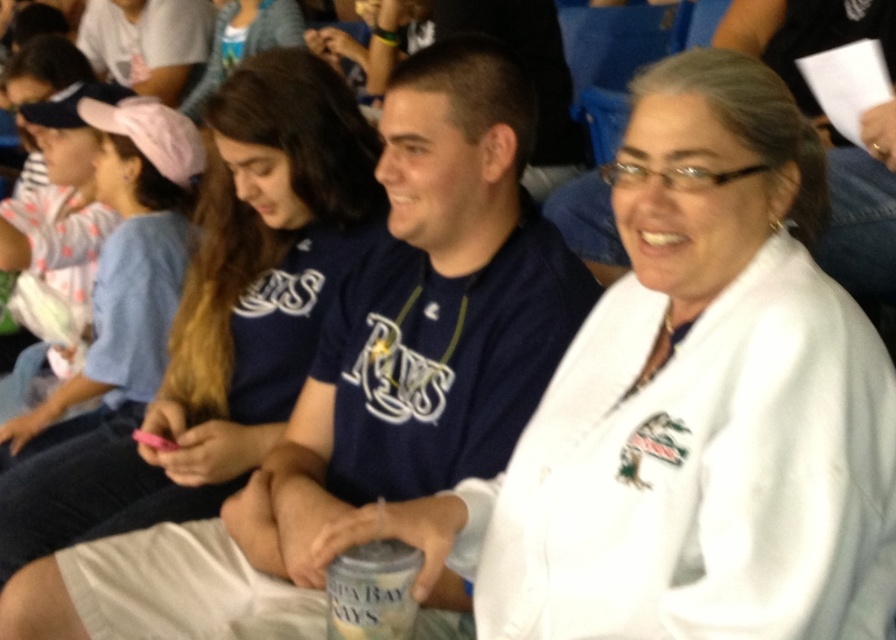
Question: Can you confirm if white fleece robe at center is thinner than pink fabric cap at upper left?

Choices:
 (A) no
 (B) yes

Answer: (A)

Question: Which of the following is the farthest from the observer?

Choices:
 (A) (263, 74)
 (B) (425, 266)

Answer: (A)

Question: Which of the following is the closest to the observer?

Choices:
 (A) (514, 356)
 (B) (336, 200)

Answer: (A)

Question: Can you confirm if matte blue shirt at center is positioned above white fleece robe at center?

Choices:
 (A) yes
 (B) no

Answer: (A)

Question: Estimate the real-world distances between objects in this image. Which object is farther from the matte blue shirt at center?

Choices:
 (A) pink fabric cap at upper left
 (B) white fleece robe at center

Answer: (B)

Question: Considering the relative positions of white fleece robe at center and pink fabric cap at upper left in the image provided, where is white fleece robe at center located with respect to pink fabric cap at upper left?

Choices:
 (A) below
 (B) above

Answer: (A)